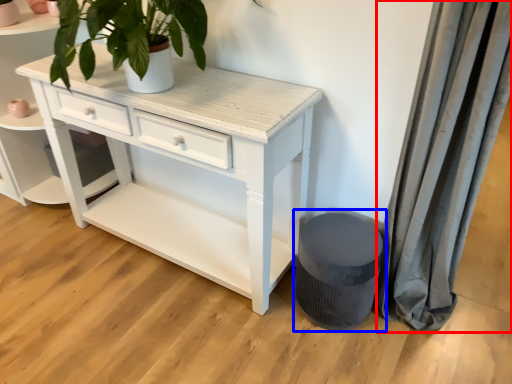
Question: Which object is further to the camera taking this photo, curtain (highlighted by a red box) or music stool (highlighted by a blue box)?

Choices:
 (A) curtain
 (B) music stool

Answer: (B)